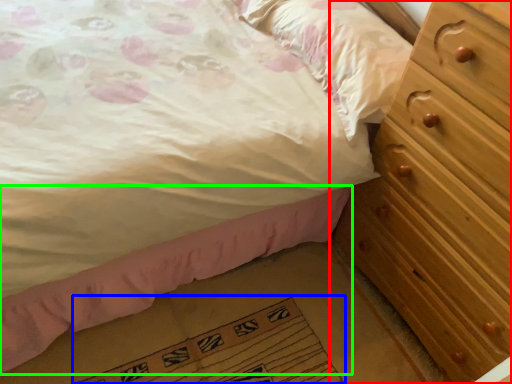
Question: Based on their relative distances, which object is farther from chest of drawers (highlighted by a red box)? Choose from doormat (highlighted by a blue box) and bed frame (highlighted by a green box).

Choices:
 (A) doormat
 (B) bed frame

Answer: (A)